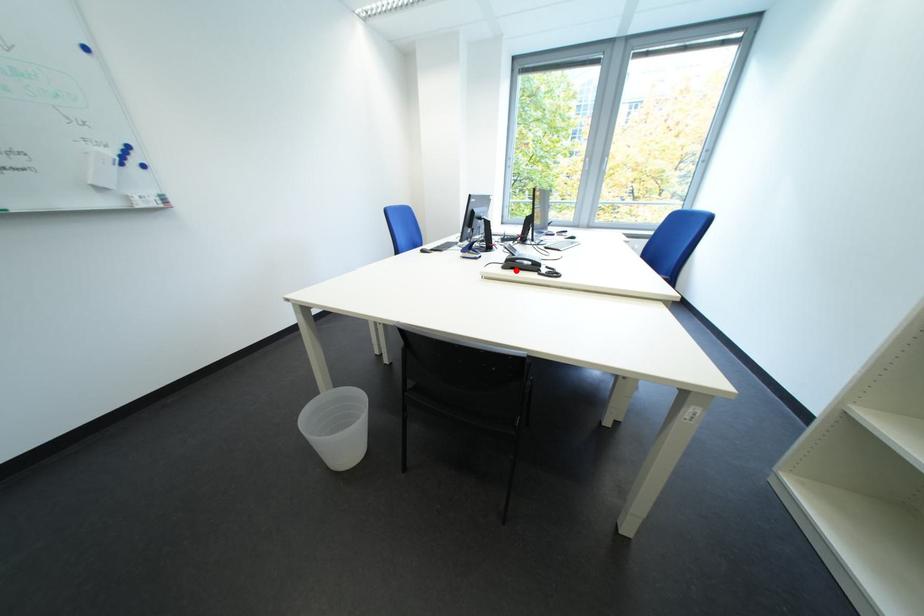
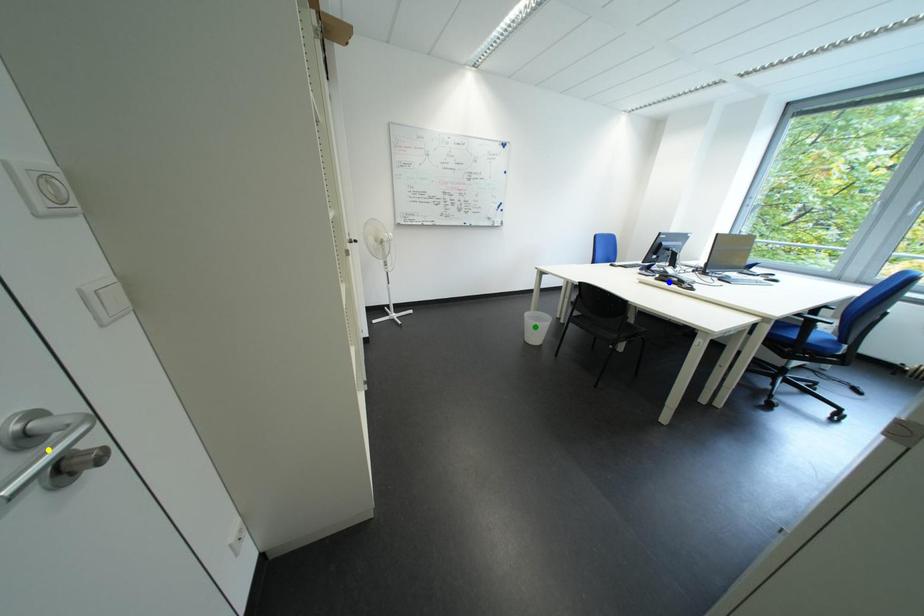
Question: I am providing you with two images of the same scene from different viewpoints. A red point is marked on the first image. You are given multiple points on the second image. Which point in image 2 is actually the same real-world point as the red point in image 1?

Choices:
 (A) green point
 (B) blue point
 (C) yellow point

Answer: (B)